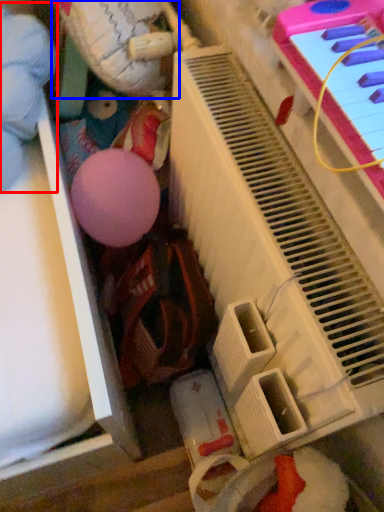
Question: Which point is closer to the camera, toy (highlighted by a red box) or toy (highlighted by a blue box)?

Choices:
 (A) toy
 (B) toy

Answer: (B)